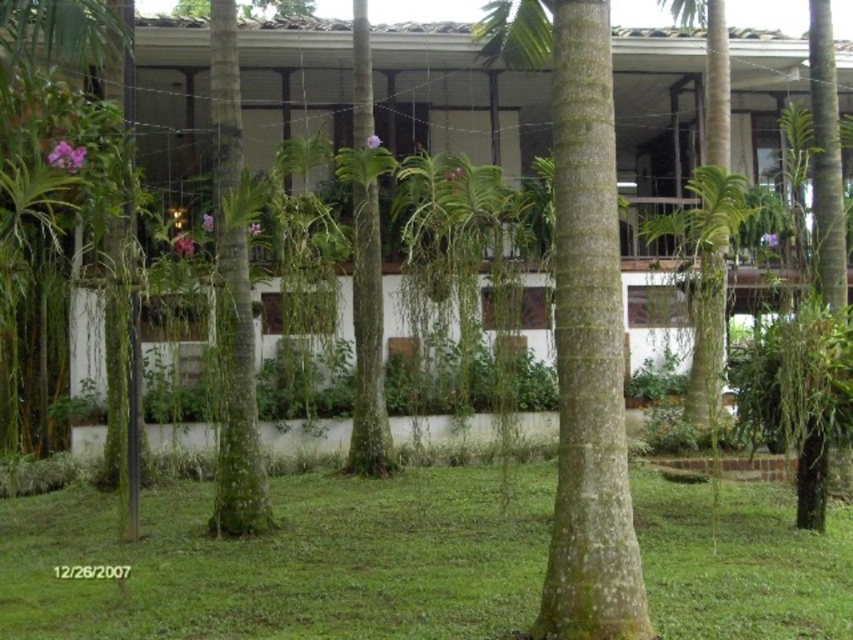
Is green grass at center smaller than green textured tree at center?

Yes.

Find the location of `green grass at center`. green grass at center is located at coordinates (285, 561).

Locate an element on the screen. Image resolution: width=853 pixels, height=640 pixels. green grass at center is located at coordinates (285, 561).

Who is more distant from viewer, (660, 584) or (355, 68)?

Point (355, 68)

Does green grass at center have a greater width compared to green leafy tree at center?

Correct, the width of green grass at center exceeds that of green leafy tree at center.

Which is behind, point (709, 593) or point (360, 410)?

Point (360, 410)

What are the coordinates of `green grass at center` in the screenshot? It's located at (285, 561).

Who is higher up, green textured tree at center or green leafy tree at center?

green textured tree at center

Consider the image. Measure the distance between green textured tree at center and camera.

The distance of green textured tree at center from camera is 6.00 meters.

The width and height of the screenshot is (853, 640). In order to click on green textured tree at center in this screenshot , I will do `click(581, 321)`.

This screenshot has width=853, height=640. I want to click on green textured tree at center, so tap(581, 321).